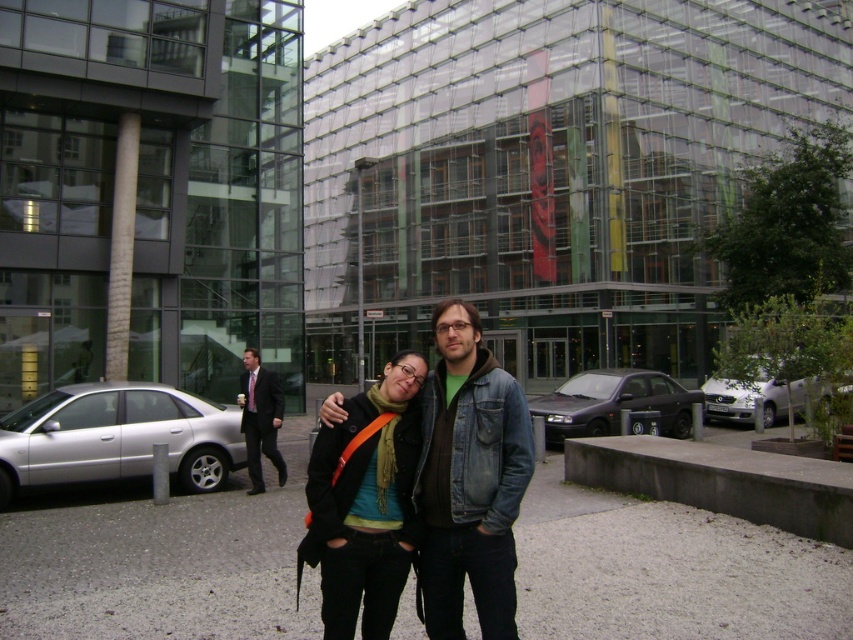
From the picture: You are standing in front of the modern glass building and see two points marked in the image. Which point, point (389, 403) or point (701, 396), is closer to you?

Point (389, 403) is closer to the viewer than point (701, 396).

You are standing in front of the modern glass building and notice two points marked in the image. Which point, point (593, 394) or point (260, 483), is closer to you?

Point (593, 394) is closer to you because it is further to the viewer than point (260, 483).